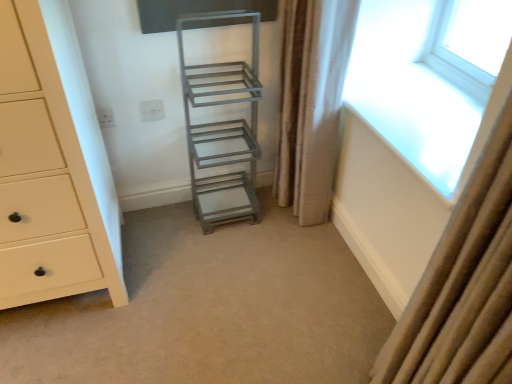
Locate an element on the screen. vacant space in between beige textured curtain at right, marked as the second curtain in a front-to-back arrangement, and matte cream chest of drawers at left is located at coordinates (200, 239).